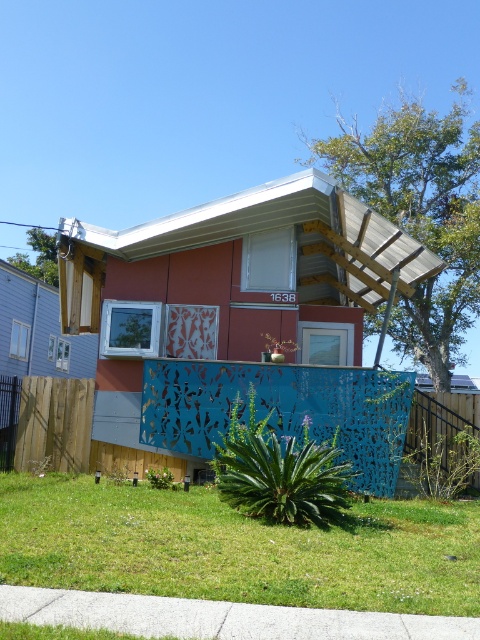
Consider the image. Is blue perforated metal fence at lower center below blue perforated metal fence at center?

Yes, blue perforated metal fence at lower center is below blue perforated metal fence at center.

Which is above, blue perforated metal fence at lower center or blue perforated metal fence at center?

blue perforated metal fence at center is higher up.

The image size is (480, 640). Find the location of `blue perforated metal fence at lower center`. blue perforated metal fence at lower center is located at coordinates (58, 420).

From the picture: Can you confirm if green grass at lower center is positioned below blue perforated metal fence at lower center?

No.

Who is positioned more to the right, green grass at lower center or blue perforated metal fence at lower center?

From the viewer's perspective, blue perforated metal fence at lower center appears more on the right side.

The height and width of the screenshot is (640, 480). Describe the element at coordinates (237, 548) in the screenshot. I see `green grass at lower center` at that location.

I want to click on green grass at lower center, so click(237, 548).

Is green grass at lower center to the left of blue perforated metal fence at center from the viewer's perspective?

Correct, you'll find green grass at lower center to the left of blue perforated metal fence at center.

Which is in front, point (124, 570) or point (433, 428)?

Point (124, 570) is in front.

The image size is (480, 640). I want to click on green grass at lower center, so click(x=237, y=548).